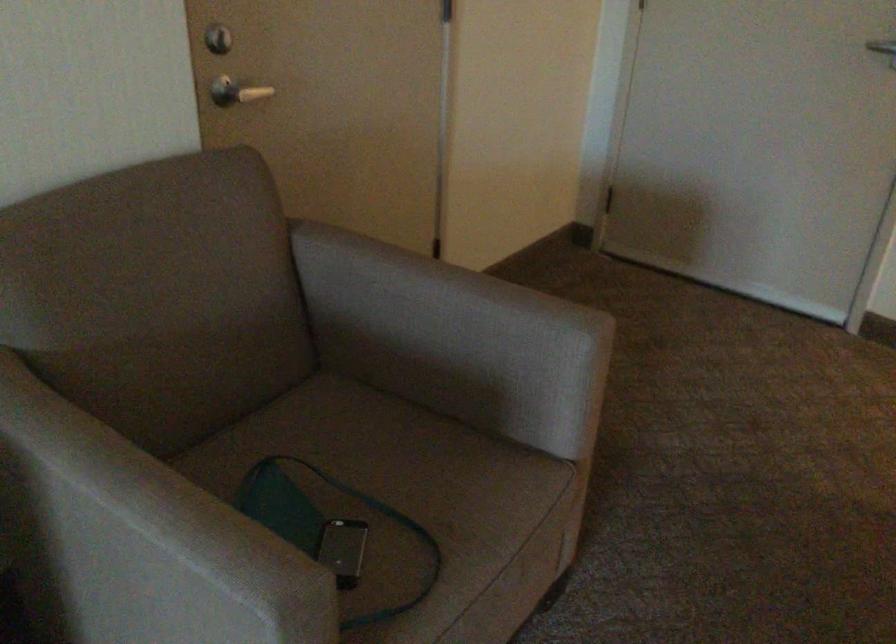
This screenshot has width=896, height=644. In order to click on chair sitting surface in this screenshot , I will do `click(412, 505)`.